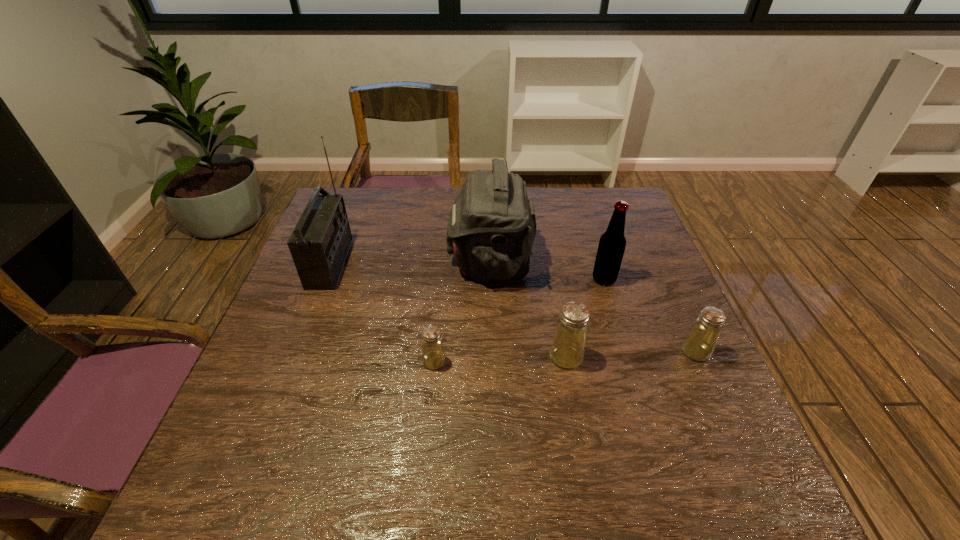
You are a GUI agent. You are given a task and a screenshot of the screen. Output one action in this format:
    pyautogui.click(x=<x>, y=<y>)
    Task: Click on the blank space that satisfies the following two spatial constraints: 1. on the back side of the shortest object; 2. on the front panel of the leftmost object
    
    Given the screenshot: What is the action you would take?
    click(444, 263)

Find the location of a particular element. This screenshot has height=540, width=960. free location that satisfies the following two spatial constraints: 1. on the front panel of the radio receiver; 2. on the back side of the beer bottle is located at coordinates (324, 279).